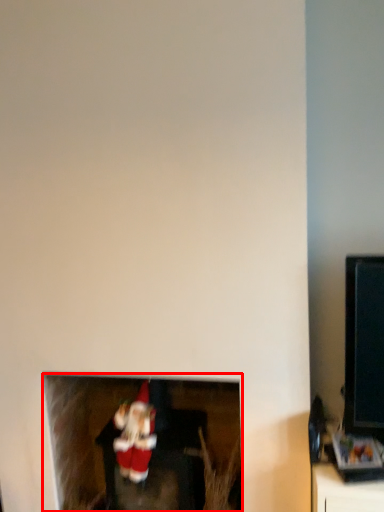
Question: From the image's perspective, where is fireplace (annotated by the red box) located in relation to santa claus in the image?

Choices:
 (A) below
 (B) above

Answer: (A)